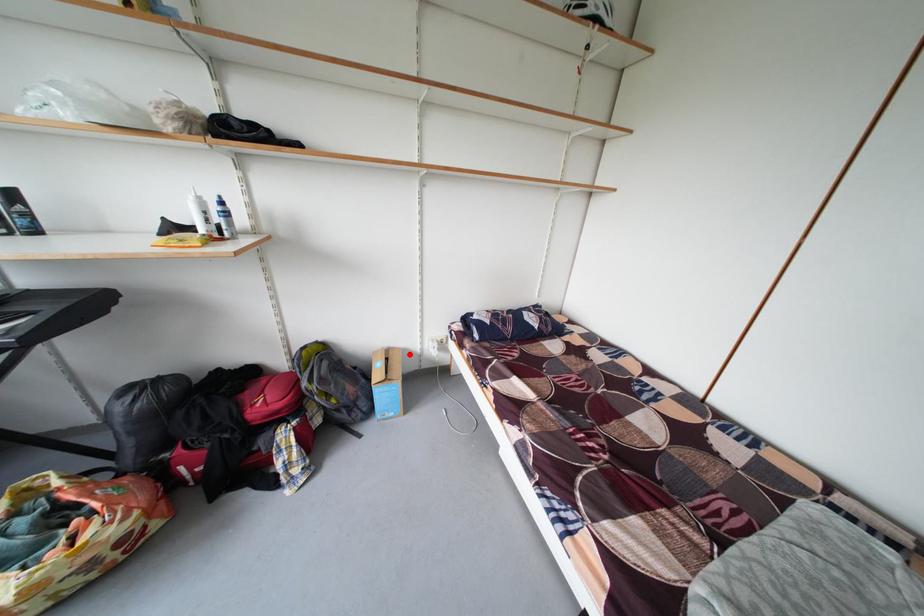
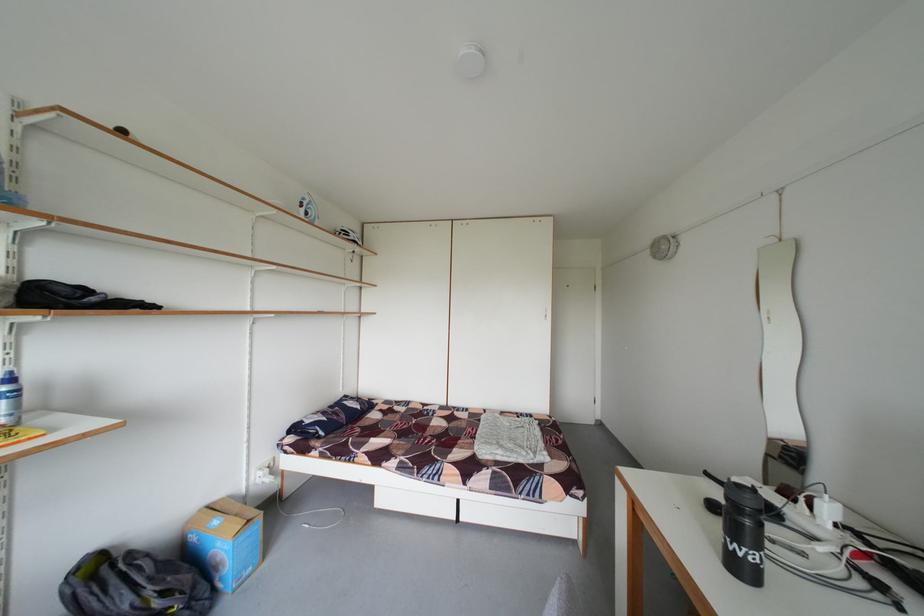
In the second image, find the point that corresponds to the highlighted location in the first image.

(233, 505)